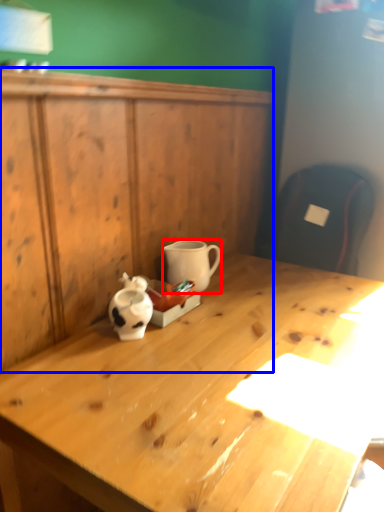
Question: Which point is closer to the camera, coffee cup (highlighted by a red box) or dresser (highlighted by a blue box)?

Choices:
 (A) coffee cup
 (B) dresser

Answer: (B)